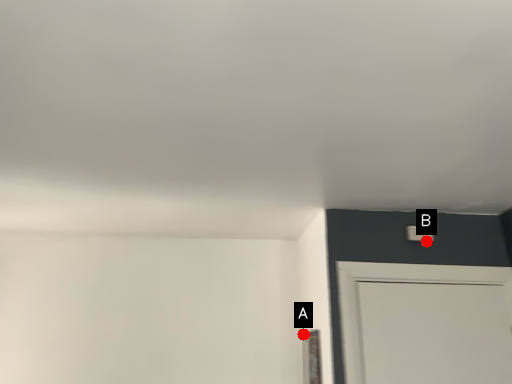
Question: Two points are circled on the image, labeled by A and B beside each circle. Which point is farther from the camera taking this photo?

Choices:
 (A) A is further
 (B) B is further

Answer: (A)